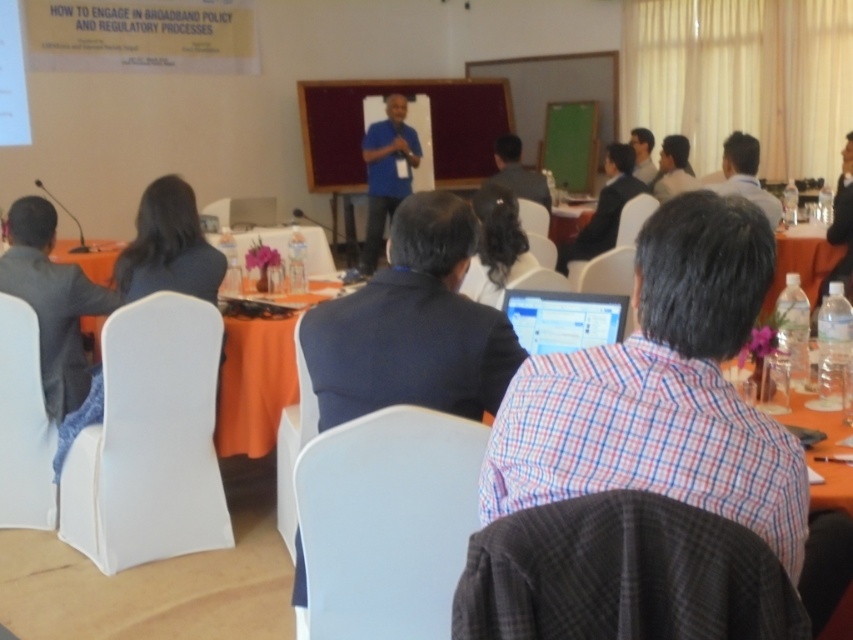
You are an attendee at this meeting and need to locate the clear plastic bottles at right. From your seat, where should you look relative to the dark gray suit at left?

The dark gray suit at left is in front of the clear plastic bottles at right, so you should look behind the dark gray suit at left to find the clear plastic bottles at right.

You are an attendee at this meeting and need to locate the dark gray suit at left and the clear plastic bottles at right. Based on the scene description, which object is positioned lower in the image?

The dark gray suit at left is below clear plastic bottles at right, so the dark gray suit at left is positioned lower in the image.